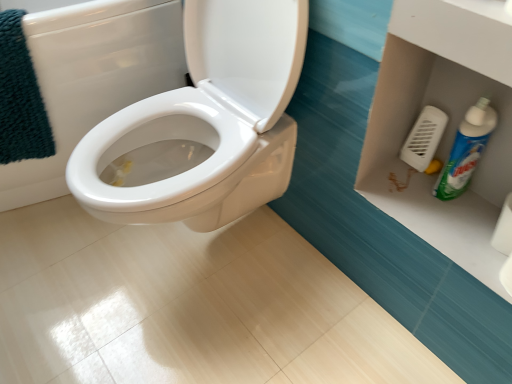
Locate an element on the screen. Image resolution: width=512 pixels, height=384 pixels. vacant space in front of green plastic bottle at lower right is located at coordinates (456, 226).